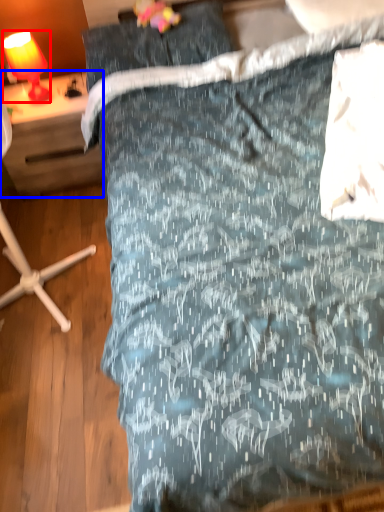
Question: Which point is closer to the camera, lamp (highlighted by a red box) or desk (highlighted by a blue box)?

Choices:
 (A) lamp
 (B) desk

Answer: (A)